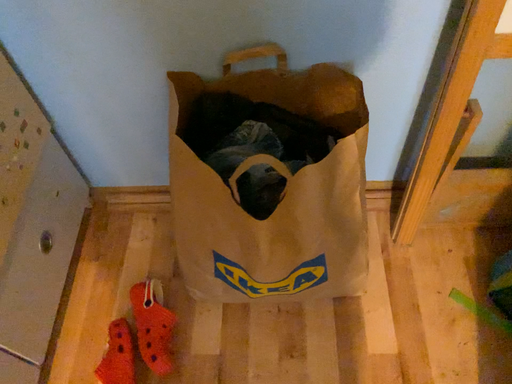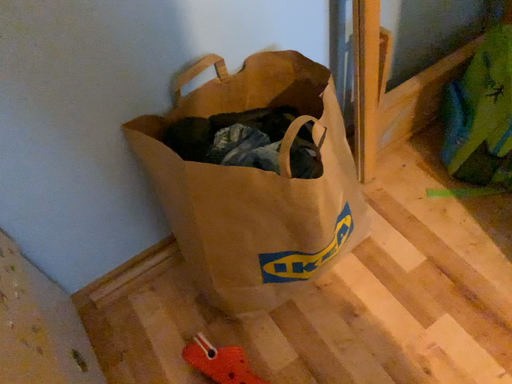
Question: Which way did the camera rotate in the video?

Choices:
 (A) rotated downward
 (B) rotated upward

Answer: (B)